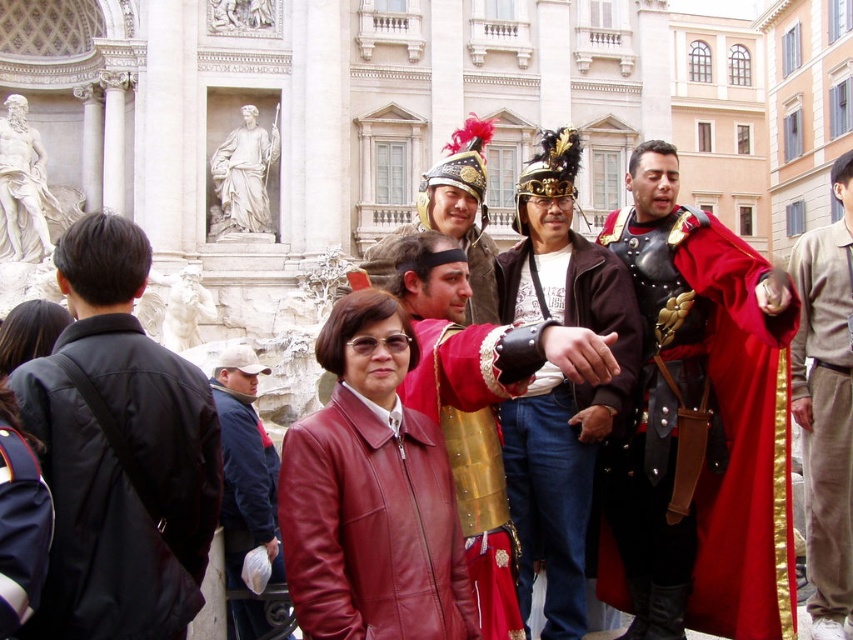
Question: In this image, where is matte black armor at center located relative to shiny gold armor at center?

Choices:
 (A) left
 (B) right

Answer: (B)

Question: Is the position of black leather jacket at left more distant than that of shiny gold armor at center?

Choices:
 (A) yes
 (B) no

Answer: (B)

Question: Which point is farther to the camera?

Choices:
 (A) tap(494, 513)
 (B) tap(4, 547)
 (C) tap(171, 573)
 (D) tap(532, 426)

Answer: (D)

Question: Is matte black armor at center to the left of blue fleece jacket at center from the viewer's perspective?

Choices:
 (A) yes
 (B) no

Answer: (B)

Question: Which object is closer to the camera taking this photo?

Choices:
 (A) dark blue fabric robe at lower left
 (B) black leather jacket at left
 (C) blue fleece jacket at center

Answer: (A)

Question: Estimate the real-world distances between objects in this image. Which object is closer to the matte black armor at center?

Choices:
 (A) leather jacket at center
 (B) dark blue fabric robe at lower left

Answer: (A)